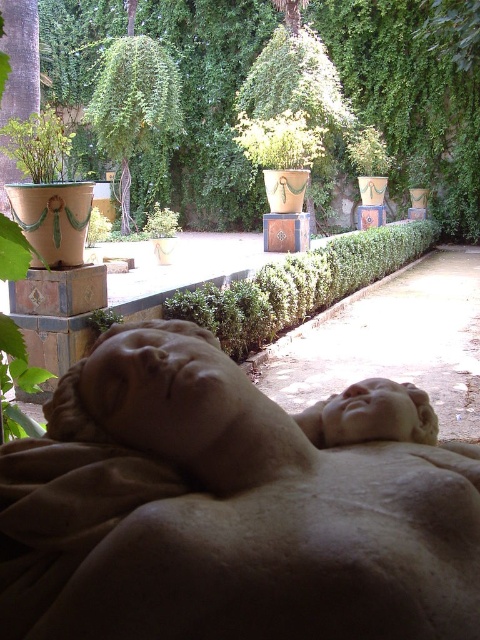
You are designing a garden layout and want to place a small bench between the green leafy hedge at upper center and the green leafy plant at lower left. Which side of the bench should face the wider object to ensure it is positioned correctly?

The green leafy hedge at upper center is wider than the green leafy plant at lower left. To position the bench correctly, the side facing the green leafy hedge at upper center should be the wider side to match its size.

You are standing at the entrance of the garden and want to take a photo of the green leafy hedge at upper center. According to the coordinates provided, where should you position yourself to capture it in the frame?

The green leafy hedge at upper center is located at coordinates point (410, 99), so you should position yourself to aim your camera towards that coordinate to capture it in the frame.

You are a landscape architect designing a garden layout. You need to place a new bench that requires a clear space of 1.2 meters in height. Given the smooth beige statue at center and the green leafy plant at lower left, which object might obstruct the bench placement due to its height?

The smooth beige statue at center has a greater height compared to the green leafy plant at lower left, so it might obstruct the bench placement due to its height.